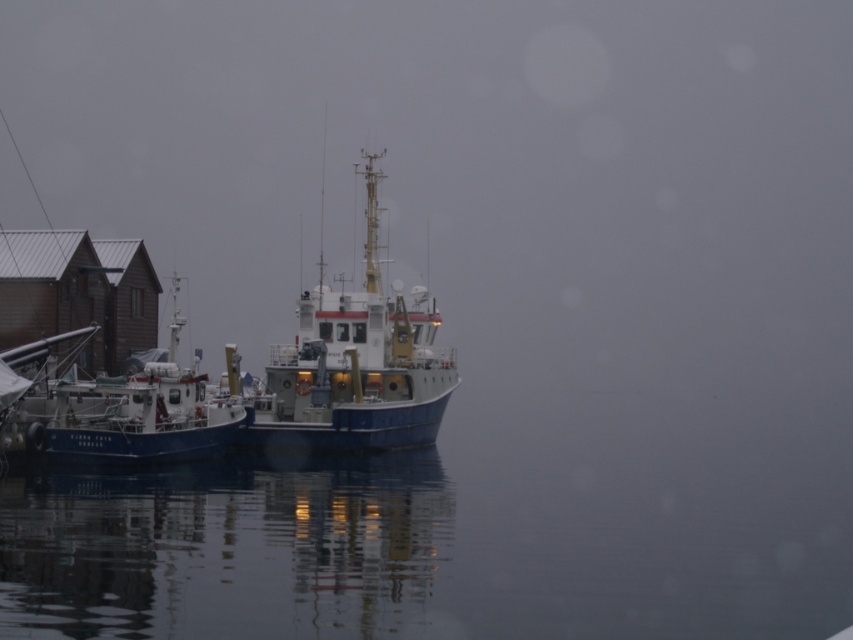
Is blue matte boat at center further to camera compared to blue matte boat at left?

Yes, blue matte boat at center is further from the viewer.

Which is in front, point (326, 314) or point (99, 385)?

Point (99, 385)

Is point (428, 300) closer to camera compared to point (175, 372)?

No, (428, 300) is behind (175, 372).

In order to click on blue matte boat at center in this screenshot , I will do tap(354, 364).